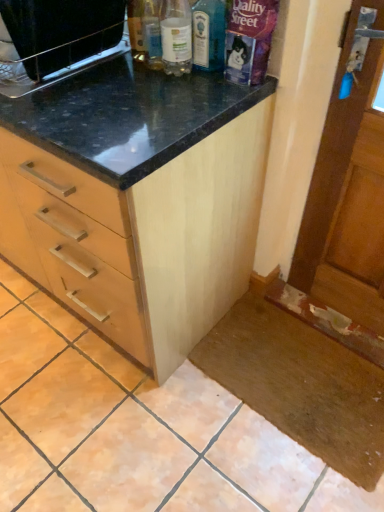
Locate an element on the screen. This screenshot has width=384, height=512. vacant space in front of clear plastic bottle at upper center, which ranks as the first bottle in left-to-right order is located at coordinates (171, 96).